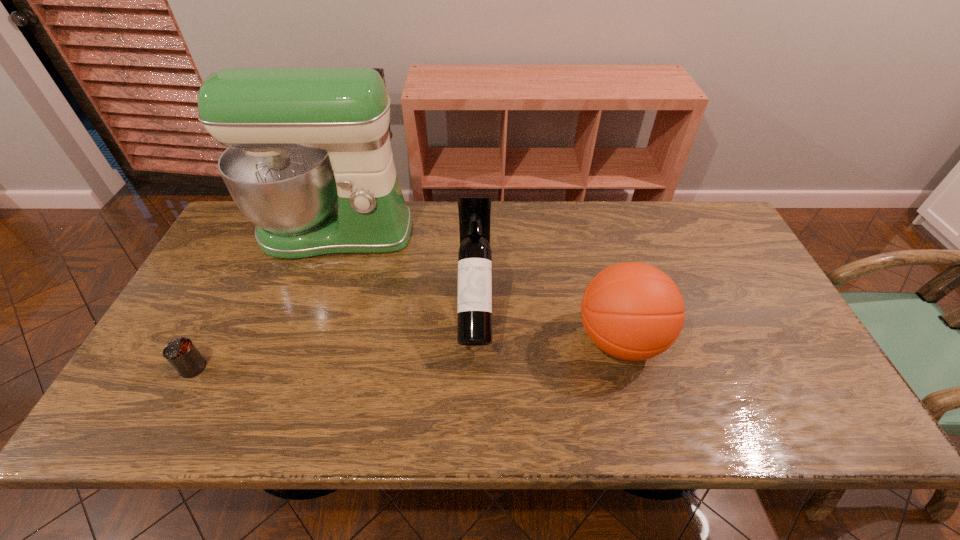
The width and height of the screenshot is (960, 540). What are the coordinates of `vacant area that lies between the can and the farthest object` in the screenshot? It's located at (264, 300).

I want to click on free spot between the mixer and the can, so click(x=264, y=300).

The height and width of the screenshot is (540, 960). Find the location of `free point between the third object from left to right and the shortest object`. free point between the third object from left to right and the shortest object is located at coordinates (334, 339).

Locate an element on the screen. vacant space that's between the can and the tallest object is located at coordinates (264, 300).

I want to click on free spot between the mixer and the second tallest object, so click(405, 271).

I want to click on free space between the basketball and the second tallest object, so click(548, 325).

At what (x,y) coordinates should I click in order to perform the action: click on vacant area that lies between the shortest object and the second tallest object. Please return your answer as a coordinate pair (x, y). Looking at the image, I should click on (334, 339).

Find the location of a particular element. The image size is (960, 540). vacant region between the rightmost object and the shortest object is located at coordinates (407, 354).

I want to click on vacant area that lies between the mixer and the wine bottle, so click(405, 271).

Where is `vacant point located between the can and the third shortest object`? The image size is (960, 540). vacant point located between the can and the third shortest object is located at coordinates (334, 339).